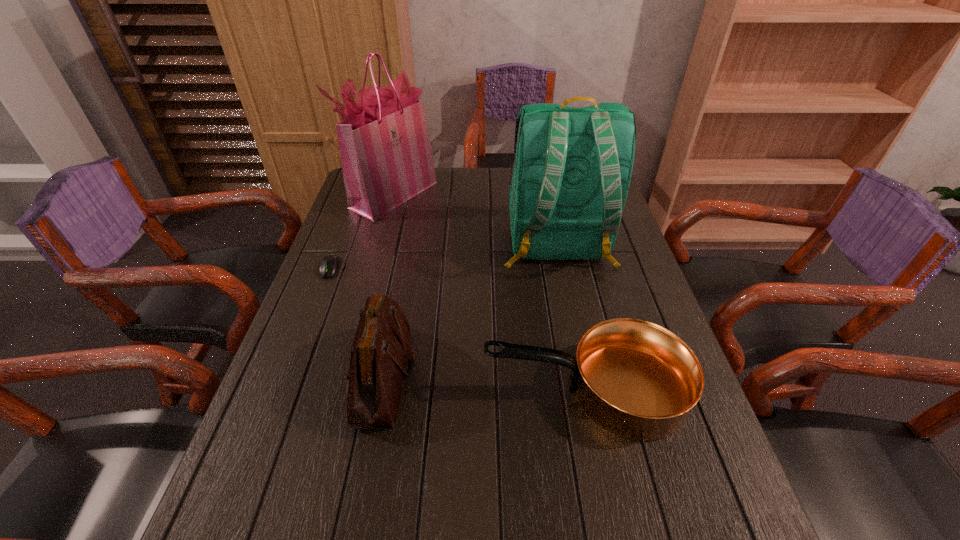
The width and height of the screenshot is (960, 540). I want to click on vacant space situated on the handle side of the frying pan, so click(x=439, y=390).

At what (x,y) coordinates should I click in order to perform the action: click on free space located 0.150m on the wheel side of the shortest object. Please return your answer as a coordinate pair (x, y). Looking at the image, I should click on click(x=311, y=319).

Where is `object that is at the far edge`? The height and width of the screenshot is (540, 960). object that is at the far edge is located at coordinates (385, 149).

Where is `shopping bag that is at the left edge`? This screenshot has height=540, width=960. shopping bag that is at the left edge is located at coordinates (385, 149).

Identify the location of computer mouse situated at the left edge. Image resolution: width=960 pixels, height=540 pixels. (330, 264).

Locate an element on the screen. backpack positioned at the right edge is located at coordinates (569, 181).

Where is `frying pan present at the right edge`? Image resolution: width=960 pixels, height=540 pixels. frying pan present at the right edge is located at coordinates (635, 379).

This screenshot has width=960, height=540. What are the coordinates of `object located in the far left corner section of the desktop` in the screenshot? It's located at click(385, 149).

The width and height of the screenshot is (960, 540). In the image, there is a desktop. What are the coordinates of `vacant region at the far edge` in the screenshot? It's located at (466, 180).

In the image, there is a desktop. Identify the location of vacant space at the near edge. The height and width of the screenshot is (540, 960). (513, 536).